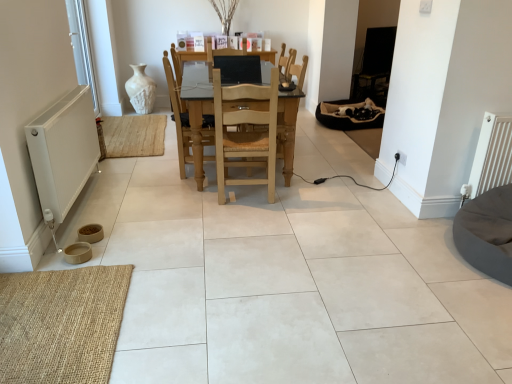
Where is `free space behind white matte radiator at lower left`? free space behind white matte radiator at lower left is located at coordinates (135, 170).